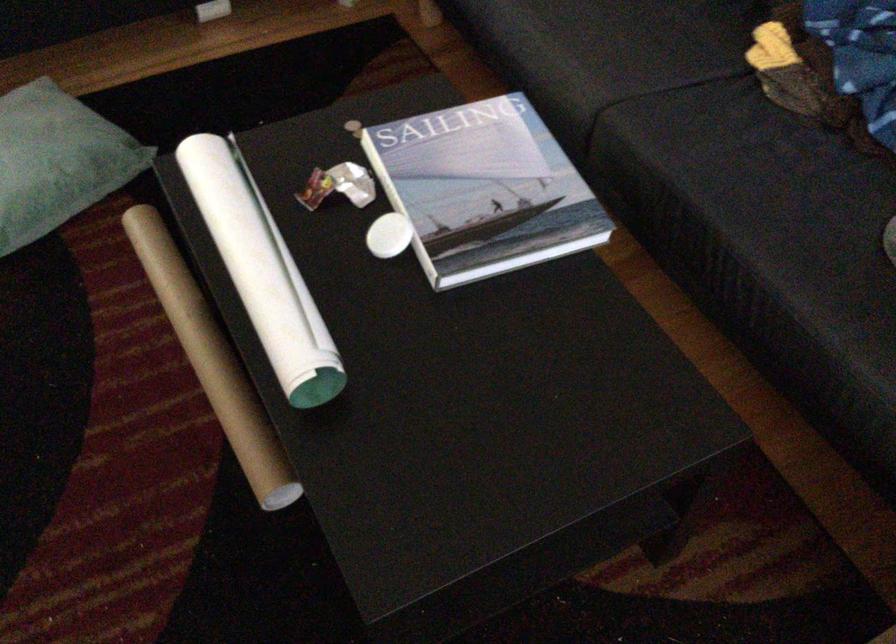
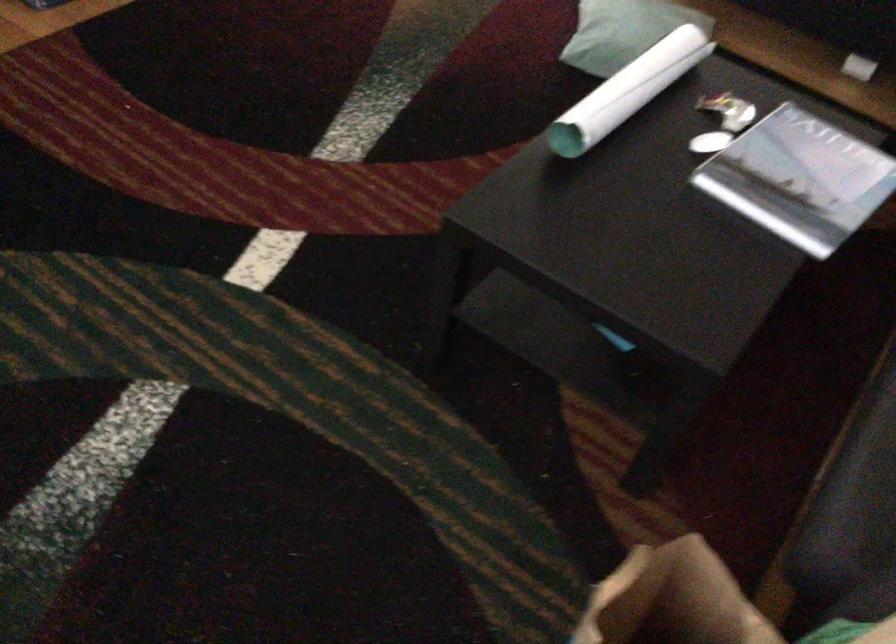
In the second image, find the point that corresponds to pixel 278 265 in the first image.

(626, 91)